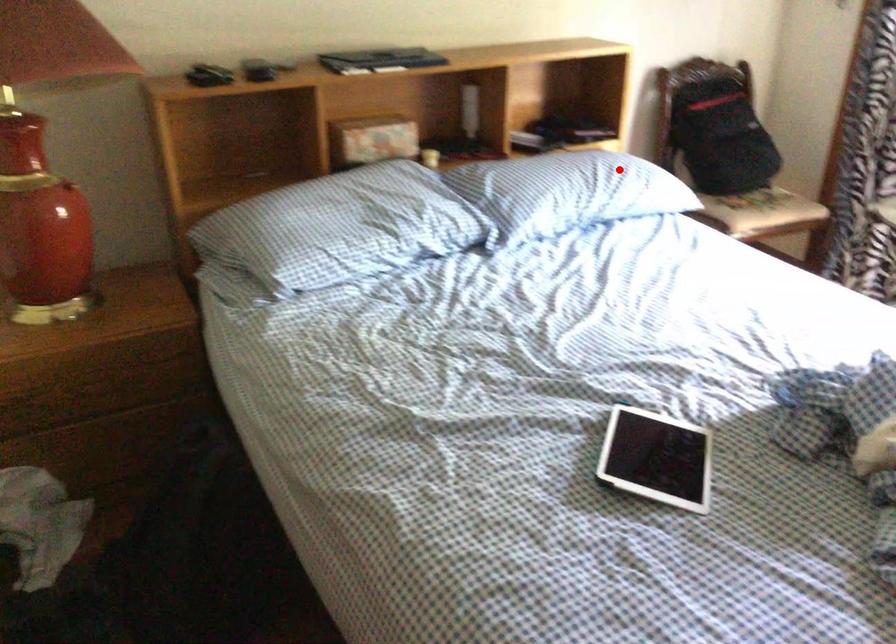
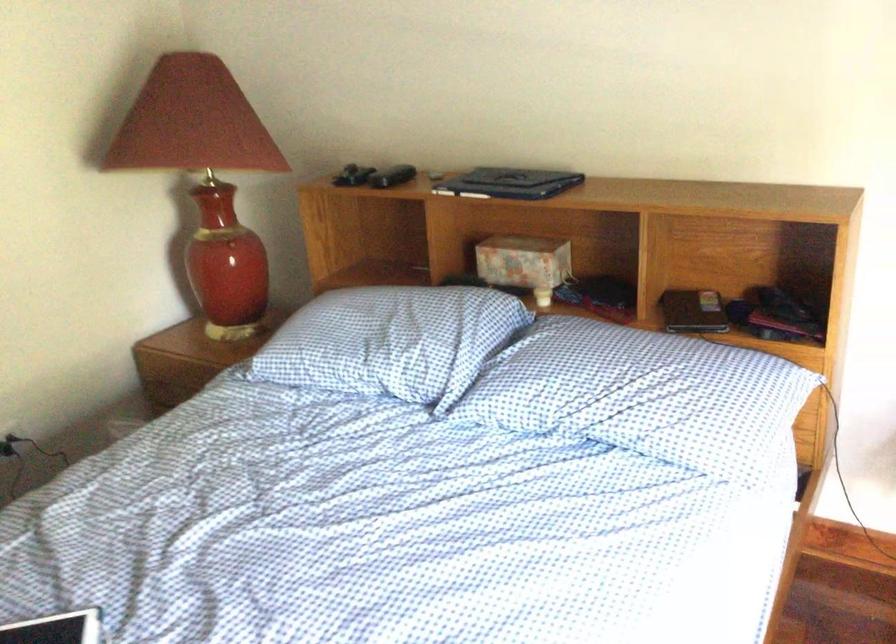
Find the pixel in the second image that matches the highlighted location in the first image.

(659, 392)